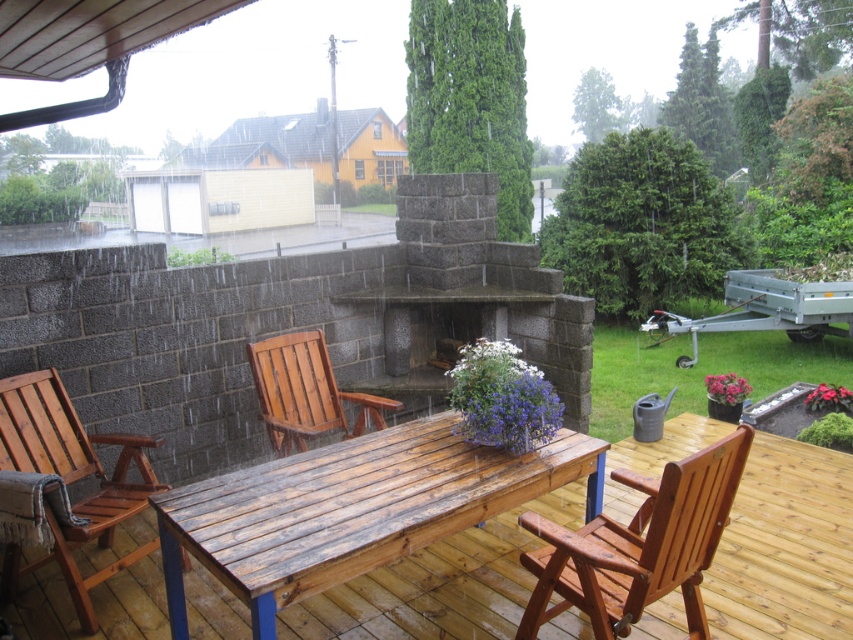
Is point (427, 516) positioned behind point (483, 195)?

No.

Who is more distant from viewer, (349, 497) or (434, 304)?

Point (434, 304)

Find the location of a particular element. The height and width of the screenshot is (640, 853). wooden table at center is located at coordinates (352, 509).

Which of these two, wooden chair with woven fabric at left or wooden chair at center, stands shorter?

wooden chair at center

Who is positioned more to the left, wooden chair with woven fabric at left or wooden chair at center?

From the viewer's perspective, wooden chair with woven fabric at left appears more on the left side.

This screenshot has width=853, height=640. What do you see at coordinates (70, 480) in the screenshot? I see `wooden chair with woven fabric at left` at bounding box center [70, 480].

Where is `wooden chair with woven fabric at left`? Image resolution: width=853 pixels, height=640 pixels. wooden chair with woven fabric at left is located at coordinates (70, 480).

Between wooden table at center and wooden chair with woven fabric at left, which one is positioned higher?

wooden chair with woven fabric at left is higher up.

Is wooden table at center positioned before wooden chair with woven fabric at left?

Yes, it is in front of wooden chair with woven fabric at left.

In order to click on wooden table at center in this screenshot , I will do `click(352, 509)`.

Locate an element on the screen. This screenshot has height=640, width=853. wooden table at center is located at coordinates (352, 509).